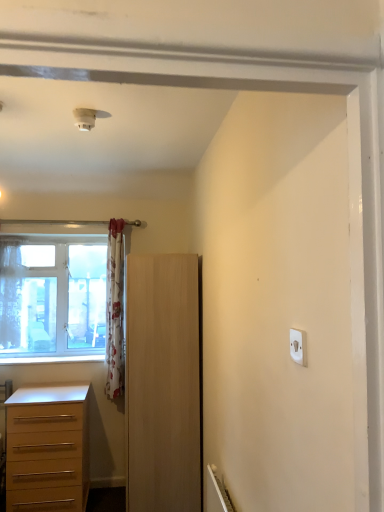
The image size is (384, 512). What do you see at coordinates (10, 294) in the screenshot?
I see `sheer floral fabric curtain at left, arranged as the first curtain when viewed from the left` at bounding box center [10, 294].

In order to face white painted wood at lower left, should I rotate leftwards or rightwards?

Rotate your view left by about 18.354°.

Identify the location of white painted wood at lower left. This screenshot has width=384, height=512. (51, 359).

At what (x,y) coordinates should I click in order to perform the action: click on white plastic light switch at upper right. Please return your answer as a coordinate pair (x, y). Image resolution: width=384 pixels, height=512 pixels. Looking at the image, I should click on (298, 346).

What is the approximate width of white plastic light switch at upper right?

white plastic light switch at upper right is 0.63 inches wide.

What do you see at coordinates (162, 383) in the screenshot? I see `light wood cupboard at center` at bounding box center [162, 383].

What do you see at coordinates (53, 298) in the screenshot?
I see `clear glass window at left` at bounding box center [53, 298].

Locate an element on the screen. The height and width of the screenshot is (512, 384). clear glass window at left is located at coordinates (53, 298).

Where is `sheer floral fabric curtain at left, arranged as the first curtain when viewed from the left`? The image size is (384, 512). sheer floral fabric curtain at left, arranged as the first curtain when viewed from the left is located at coordinates (10, 294).

How far apart are floral fabric curtain at left, which is the 1th curtain in right-to-left order, and clear glass window at left?

floral fabric curtain at left, which is the 1th curtain in right-to-left order, and clear glass window at left are 35.29 centimeters apart from each other.

Which object is further away from the camera, floral fabric curtain at left, arranged as the second curtain when viewed from the left, or clear glass window at left?

clear glass window at left is behind.

Is floral fabric curtain at left, which is the 1th curtain in right-to-left order, touching clear glass window at left?

floral fabric curtain at left, which is the 1th curtain in right-to-left order, and clear glass window at left are clearly separated.

Which object is thinner, floral fabric curtain at left, arranged as the second curtain when viewed from the left, or clear glass window at left?

clear glass window at left is thinner.

Is light brown wooden chest of drawers at lower left in contact with light wood cupboard at center?

No, light brown wooden chest of drawers at lower left is not beside light wood cupboard at center.

From the image's perspective, between light brown wooden chest of drawers at lower left and light wood cupboard at center, which one is located above?

light wood cupboard at center is shown above in the image.

Is light brown wooden chest of drawers at lower left oriented towards light wood cupboard at center?

No, light brown wooden chest of drawers at lower left is not turned towards light wood cupboard at center.

Is light brown wooden chest of drawers at lower left in front of or behind light wood cupboard at center in the image?

light brown wooden chest of drawers at lower left is behind light wood cupboard at center.

Is light wood cupboard at center not within clear glass window at left?

light wood cupboard at center is positioned outside clear glass window at left.

Is point (127, 494) farther from viewer compared to point (69, 301)?

No, (127, 494) is closer to viewer.

Measure the distance between light wood cupboard at center and clear glass window at left.

light wood cupboard at center and clear glass window at left are 37.29 inches apart from each other.

Can you confirm if light wood cupboard at center is positioned to the right of clear glass window at left?

Correct, you'll find light wood cupboard at center to the right of clear glass window at left.

Who is smaller, white plastic light switch at upper right or floral fabric curtain at left, which is the 1th curtain in right-to-left order?

white plastic light switch at upper right.

Considering the relative positions of white plastic light switch at upper right and floral fabric curtain at left, arranged as the second curtain when viewed from the left, in the image provided, is white plastic light switch at upper right to the right of floral fabric curtain at left, arranged as the second curtain when viewed from the left, from the viewer's perspective?

Indeed, white plastic light switch at upper right is positioned on the right side of floral fabric curtain at left, arranged as the second curtain when viewed from the left.

Between white plastic light switch at upper right and floral fabric curtain at left, which is the 1th curtain in right-to-left order, which one has less height?

Standing shorter between the two is white plastic light switch at upper right.

What's the angular difference between white plastic light switch at upper right and floral fabric curtain at left, arranged as the second curtain when viewed from the left,'s facing directions?

The facing directions of white plastic light switch at upper right and floral fabric curtain at left, arranged as the second curtain when viewed from the left, are 91.5 degrees apart.

Identify the location of light switch in front of the sheer floral fabric curtain at left, arranged as the first curtain when viewed from the left. (298, 346).

From a real-world perspective, between sheer floral fabric curtain at left, which ranks as the 2th curtain in right-to-left order, and white plastic light switch at upper right, who is vertically lower?

From a 3D spatial view, white plastic light switch at upper right is below.

Considering the positions of objects sheer floral fabric curtain at left, which ranks as the 2th curtain in right-to-left order, and white plastic light switch at upper right in the image provided, who is in front, sheer floral fabric curtain at left, which ranks as the 2th curtain in right-to-left order, or white plastic light switch at upper right?

white plastic light switch at upper right.

Are clear glass window at left and light brown wooden chest of drawers at lower left located far from each other?

No.

Could you tell me if clear glass window at left is turned towards light brown wooden chest of drawers at lower left?

No, clear glass window at left does not turn towards light brown wooden chest of drawers at lower left.

Considering the positions of point (54, 348) and point (11, 398), is point (54, 348) closer or farther from the camera than point (11, 398)?

Clearly, point (54, 348) is more distant from the camera than point (11, 398).

Can you confirm if floral fabric curtain at left, which is the 1th curtain in right-to-left order, is smaller than light wood cupboard at center?

Yes.

Considering the positions of points (113, 368) and (180, 398), is point (113, 368) closer to camera compared to point (180, 398)?

No, it is not.

Is floral fabric curtain at left, arranged as the second curtain when viewed from the left, far from light wood cupboard at center?

No, floral fabric curtain at left, arranged as the second curtain when viewed from the left, is not far from light wood cupboard at center.

Is floral fabric curtain at left, which is the 1th curtain in right-to-left order, positioned with its back to light wood cupboard at center?

No, floral fabric curtain at left, which is the 1th curtain in right-to-left order, is not facing away from light wood cupboard at center.

Find the location of a particular element. The width and height of the screenshot is (384, 512). curtain located underneath the clear glass window at left (from a real-world perspective) is located at coordinates (115, 309).

In order to click on chest of drawers on the left of the light wood cupboard at center in this screenshot , I will do `click(48, 449)`.

From the image, which object appears to be nearer to floral fabric curtain at left, which is the 1th curtain in right-to-left order, light wood cupboard at center or white painted wood at lower left?

Based on the image, white painted wood at lower left appears to be nearer to floral fabric curtain at left, which is the 1th curtain in right-to-left order.

From the image, which object appears to be nearer to white painted wood at lower left, light brown wooden chest of drawers at lower left or floral fabric curtain at left, arranged as the second curtain when viewed from the left?

floral fabric curtain at left, arranged as the second curtain when viewed from the left, lies closer to white painted wood at lower left than the other object.

When comparing their distances from sheer floral fabric curtain at left, arranged as the first curtain when viewed from the left, does white painted wood at lower left or light wood cupboard at center seem closer?

Among the two, white painted wood at lower left is located nearer to sheer floral fabric curtain at left, arranged as the first curtain when viewed from the left.

Considering their positions, is clear glass window at left positioned closer to white painted wood at lower left than light wood cupboard at center?

Among the two, clear glass window at left is located nearer to white painted wood at lower left.

From the image, which object appears to be nearer to white painted wood at lower left, white plastic light switch at upper right or sheer floral fabric curtain at left, which ranks as the 2th curtain in right-to-left order?

sheer floral fabric curtain at left, which ranks as the 2th curtain in right-to-left order.

Based on their spatial positions, is clear glass window at left or sheer floral fabric curtain at left, arranged as the first curtain when viewed from the left, further from light wood cupboard at center?

sheer floral fabric curtain at left, arranged as the first curtain when viewed from the left, lies further to light wood cupboard at center than the other object.

Estimate the real-world distances between objects in this image. Which object is closer to white plastic light switch at upper right, clear glass window at left or white painted wood at lower left?

Among the two, white painted wood at lower left is located nearer to white plastic light switch at upper right.

From the image, which object appears to be farther from clear glass window at left, floral fabric curtain at left, which is the 1th curtain in right-to-left order, or white painted wood at lower left?

white painted wood at lower left lies further to clear glass window at left than the other object.

The image size is (384, 512). Find the location of `curtain between clear glass window at left and light wood cupboard at center from left to right`. curtain between clear glass window at left and light wood cupboard at center from left to right is located at coordinates (115, 309).

You are a GUI agent. You are given a task and a screenshot of the screen. Output one action in this format:
    pyautogui.click(x=<x>, y=<y>)
    Task: Click on the cupboard between white plastic light switch at upper right and clear glass window at left in the front-back direction
    
    Given the screenshot: What is the action you would take?
    pyautogui.click(x=162, y=383)

Locate an element on the screen. chest of drawers between white painted wood at lower left and light wood cupboard at center is located at coordinates (48, 449).

In order to click on cupboard that lies between floral fabric curtain at left, arranged as the second curtain when viewed from the left, and light brown wooden chest of drawers at lower left from top to bottom in this screenshot , I will do `click(162, 383)`.